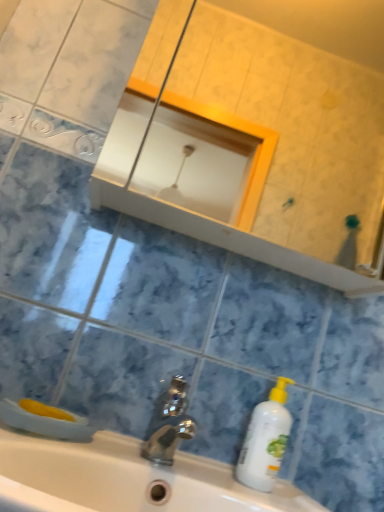
Question: Is white glossy sink at center with matte white mirror at upper center?

Choices:
 (A) yes
 (B) no

Answer: (B)

Question: Is the position of white glossy sink at center more distant than that of matte white mirror at upper center?

Choices:
 (A) no
 (B) yes

Answer: (A)

Question: Is white glossy sink at center far from matte white mirror at upper center?

Choices:
 (A) no
 (B) yes

Answer: (B)

Question: Is white glossy sink at center smaller than matte white mirror at upper center?

Choices:
 (A) no
 (B) yes

Answer: (B)

Question: Is white glossy sink at center bigger than matte white mirror at upper center?

Choices:
 (A) yes
 (B) no

Answer: (B)

Question: Do you think white plastic bottle at lower right is within white glossy sink at center, or outside of it?

Choices:
 (A) outside
 (B) inside

Answer: (A)

Question: From a real-world perspective, is white plastic bottle at lower right positioned above or below white glossy sink at center?

Choices:
 (A) above
 (B) below

Answer: (A)

Question: From the image's perspective, is white plastic bottle at lower right positioned above or below white glossy sink at center?

Choices:
 (A) above
 (B) below

Answer: (A)

Question: Considering the positions of white plastic bottle at lower right and white glossy sink at center in the image, is white plastic bottle at lower right taller or shorter than white glossy sink at center?

Choices:
 (A) tall
 (B) short

Answer: (A)

Question: Looking at their shapes, would you say polished metallic faucet at center is wider or thinner than white glossy sink at center?

Choices:
 (A) wide
 (B) thin

Answer: (B)

Question: In the image, is polished metallic faucet at center on the left side or the right side of white glossy sink at center?

Choices:
 (A) left
 (B) right

Answer: (B)

Question: From their relative heights in the image, would you say polished metallic faucet at center is taller or shorter than white glossy sink at center?

Choices:
 (A) short
 (B) tall

Answer: (A)

Question: From the image's perspective, is polished metallic faucet at center located above or below white glossy sink at center?

Choices:
 (A) above
 (B) below

Answer: (A)

Question: Considering the positions of matte white mirror at upper center and white plastic bottle at lower right in the image, is matte white mirror at upper center taller or shorter than white plastic bottle at lower right?

Choices:
 (A) tall
 (B) short

Answer: (A)

Question: Considering the relative positions of matte white mirror at upper center and white plastic bottle at lower right in the image provided, is matte white mirror at upper center to the left or to the right of white plastic bottle at lower right?

Choices:
 (A) right
 (B) left

Answer: (A)